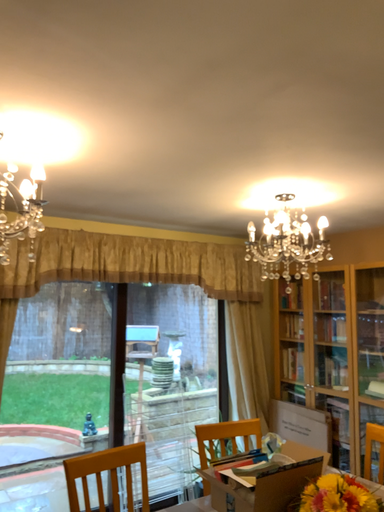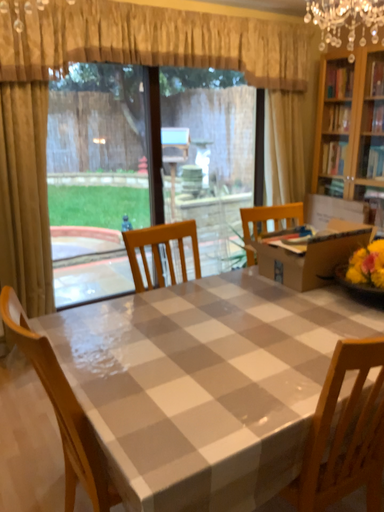
Question: Which way did the camera rotate in the video?

Choices:
 (A) rotated upward
 (B) rotated downward

Answer: (B)